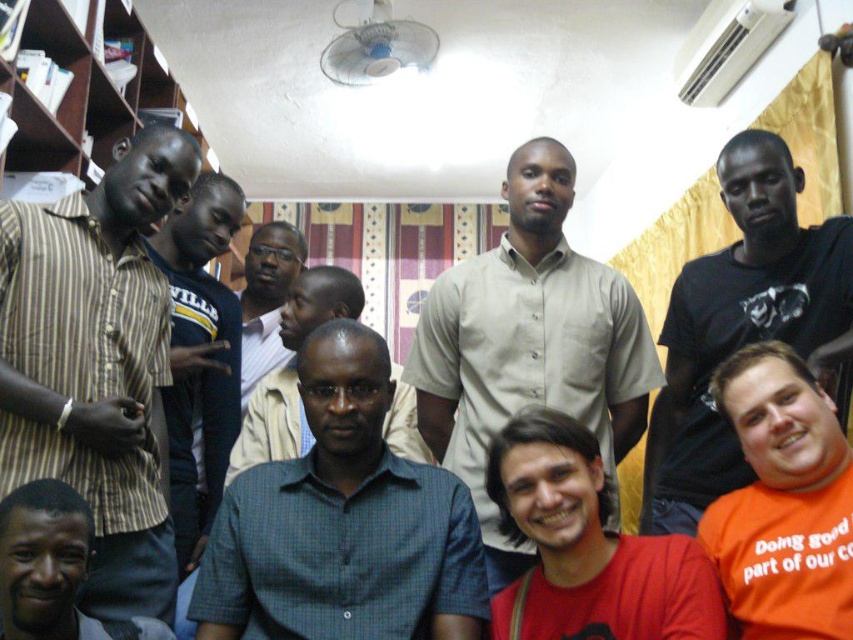
Can you confirm if green checkered shirt at center is wider than dark green shirt at center?

Incorrect, green checkered shirt at center's width does not surpass dark green shirt at center's.

Is green checkered shirt at center to the left of dark green shirt at center from the viewer's perspective?

In fact, green checkered shirt at center is to the right of dark green shirt at center.

At what (x,y) coordinates should I click in order to perform the action: click on green checkered shirt at center. Please return your answer as a coordinate pair (x, y). Looking at the image, I should click on (343, 524).

Locate an element on the screen. Image resolution: width=853 pixels, height=640 pixels. green checkered shirt at center is located at coordinates (343, 524).

Does striped cotton shirt at left have a smaller size compared to dark green shirt at center?

Correct, striped cotton shirt at left occupies less space than dark green shirt at center.

The height and width of the screenshot is (640, 853). I want to click on striped cotton shirt at left, so click(96, 364).

You are a GUI agent. You are given a task and a screenshot of the screen. Output one action in this format:
    pyautogui.click(x=<x>, y=<y>)
    Task: Click on the striped cotton shirt at left
    
    Given the screenshot: What is the action you would take?
    pyautogui.click(x=96, y=364)

Is light beige shirt at center positioned before dark blue jersey at left?

Yes, light beige shirt at center is closer to the viewer.

Who is more distant from viewer, (646, 381) or (206, 272)?

Positioned behind is point (206, 272).

Describe the element at coordinates (529, 344) in the screenshot. I see `light beige shirt at center` at that location.

The image size is (853, 640). I want to click on light beige shirt at center, so click(x=529, y=344).